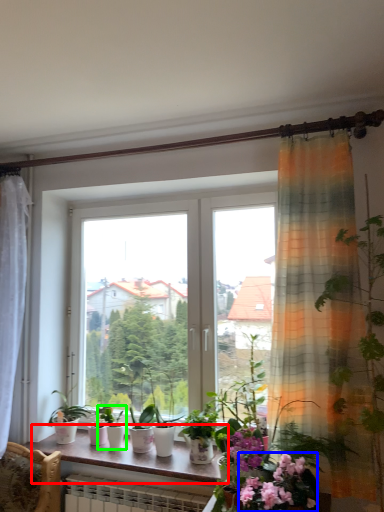
Question: Based on their relative distances, which object is nearer to window sill (highlighted by a red box)? Choose from flower (highlighted by a blue box) and houseplant (highlighted by a green box).

Choices:
 (A) flower
 (B) houseplant

Answer: (B)